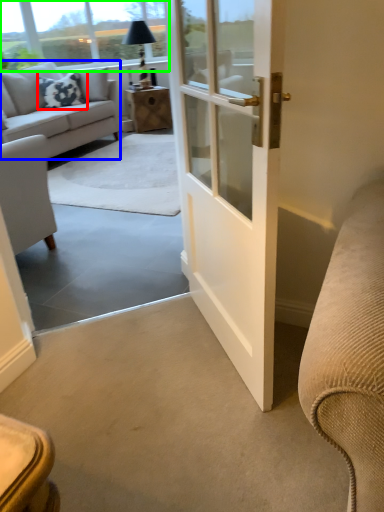
Question: Which object is the closest to the pillow (highlighted by a red box)? Choose among these: studio couch (highlighted by a blue box) or window screen (highlighted by a green box).

Choices:
 (A) studio couch
 (B) window screen

Answer: (A)